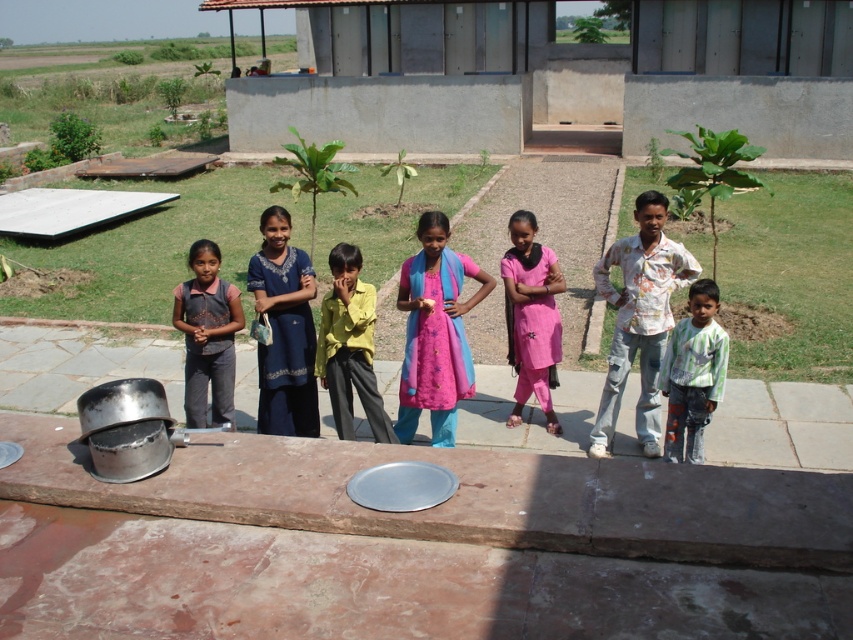
Question: Among these points, which one is nearest to the camera?

Choices:
 (A) (x=293, y=276)
 (B) (x=209, y=246)
 (C) (x=357, y=348)
 (D) (x=456, y=280)

Answer: (C)

Question: From the image, what is the correct spatial relationship of matte black shirt at left in relation to striped cotton shirt at center?

Choices:
 (A) left
 (B) right

Answer: (A)

Question: Is blue cotton dress at center above striped cotton shirt at center?

Choices:
 (A) no
 (B) yes

Answer: (B)

Question: Which point is closer to the camera?

Choices:
 (A) pink cotton dress at center
 (B) blue cotton dress at center

Answer: (B)

Question: Based on their relative distances, which object is nearer to the pink fabric dress at center?

Choices:
 (A) matte black shirt at left
 (B) yellow matte shirt at center
 (C) blue cotton dress at center
 (D) pink cotton dress at center

Answer: (B)

Question: Can you confirm if pink fabric dress at center is positioned below striped cotton shirt at center?

Choices:
 (A) no
 (B) yes

Answer: (A)